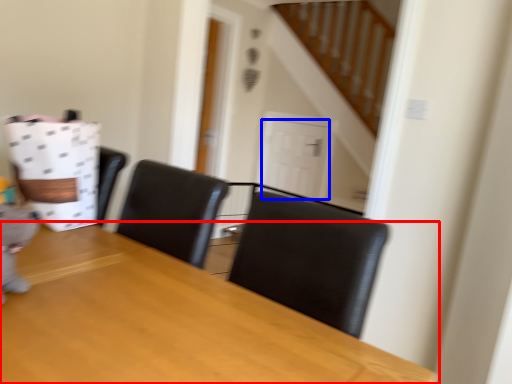
Question: Which object appears closest to the camera in this image, table (highlighted by a red box) or door (highlighted by a blue box)?

Choices:
 (A) table
 (B) door

Answer: (A)